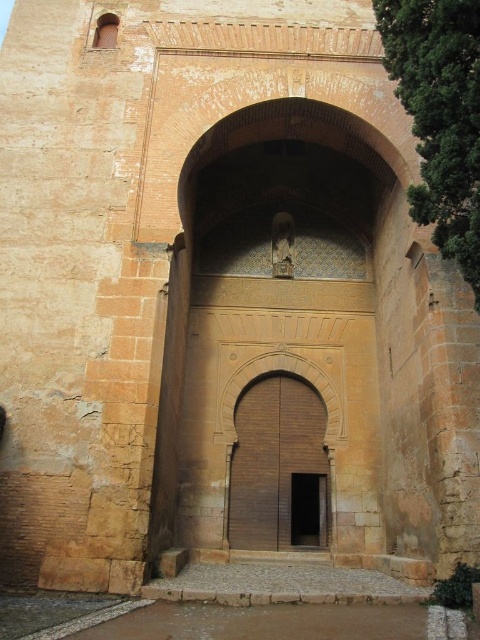
Does point (277, 392) lie behind point (290, 492)?

Yes.

Which is in front, point (288, 515) or point (294, 531)?

Point (288, 515) is in front.

Where is `brown wooden door at center`? This screenshot has width=480, height=640. brown wooden door at center is located at coordinates (278, 467).